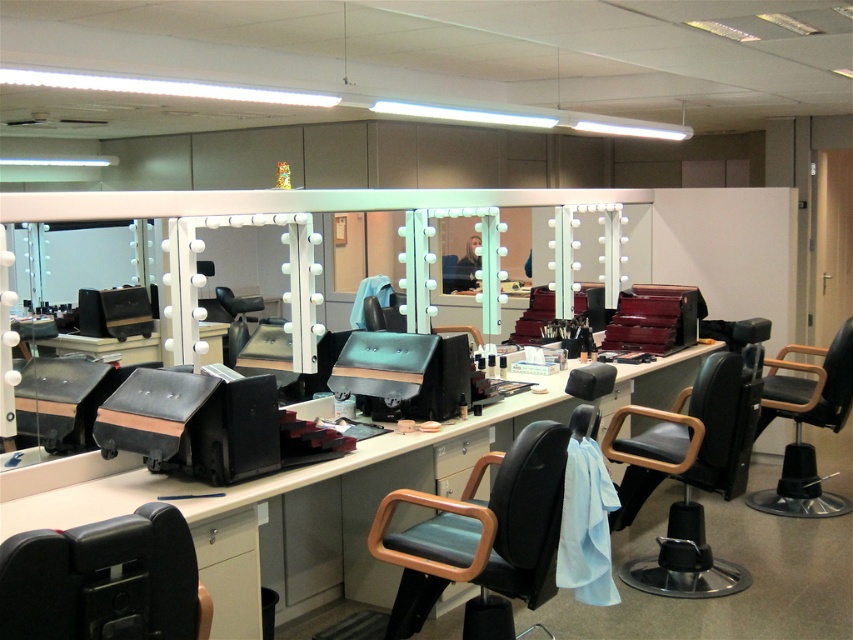
Question: Can you confirm if matte black swivel chair at center is thinner than black leather chair at center?

Choices:
 (A) no
 (B) yes

Answer: (B)

Question: Which object appears farthest from the camera in this image?

Choices:
 (A) black leather chair at lower right
 (B) black leather chair at center

Answer: (A)

Question: Does matte black swivel chair at center have a greater width compared to black leather chair at lower right?

Choices:
 (A) yes
 (B) no

Answer: (A)

Question: Which of these objects is positioned closest to the black matte swivel chair at center?

Choices:
 (A) matte black swivel chair at center
 (B) black leather chair at center
 (C) black leather chair at lower right

Answer: (A)

Question: Which is farther from the matte black swivel chair at center?

Choices:
 (A) black leather chair at lower right
 (B) matte black barber chair at center

Answer: (B)

Question: Is black matte swivel chair at center behind matte black barber chair at center?

Choices:
 (A) no
 (B) yes

Answer: (A)